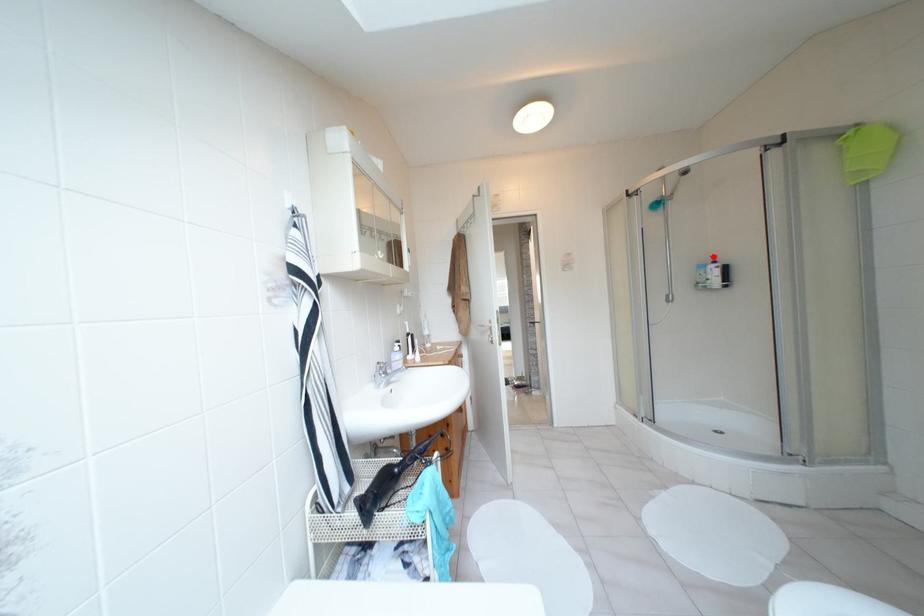
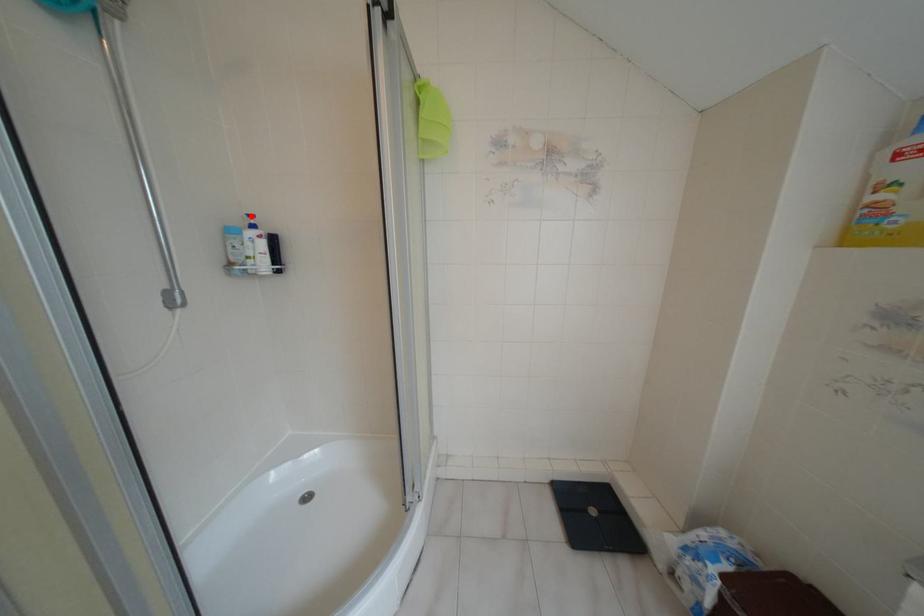
I am providing you with two images of the same scene from different viewpoints. A red point is marked on the first image and another point is marked on the second image. Does the point marked in image1 correspond to the same location as the one in image2?

Yes